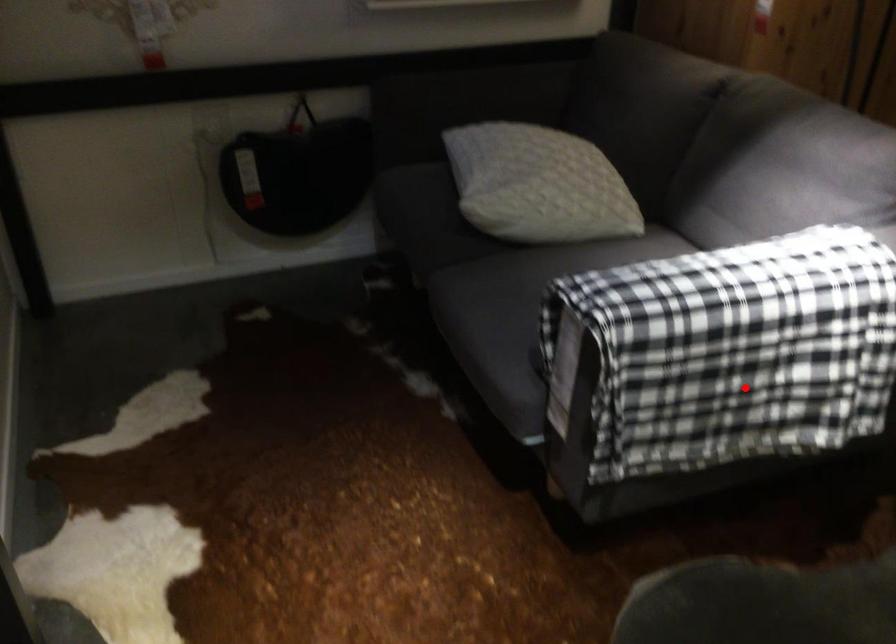
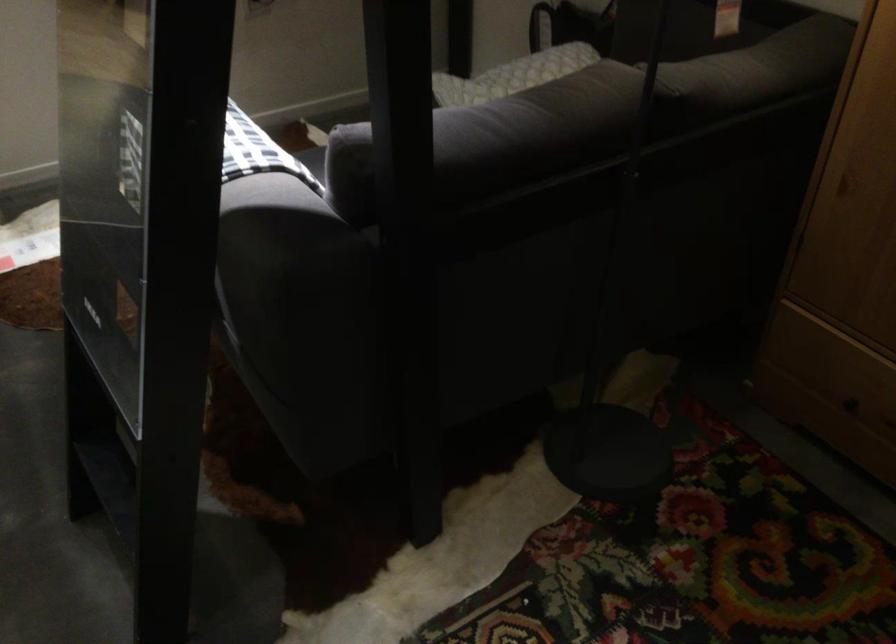
Question: I am providing you with two images of the same scene from different viewpoints. A red point is marked on the first image. At the location where the point appears in image 1, is it still visible in image 2?

Choices:
 (A) Yes
 (B) No

Answer: (B)